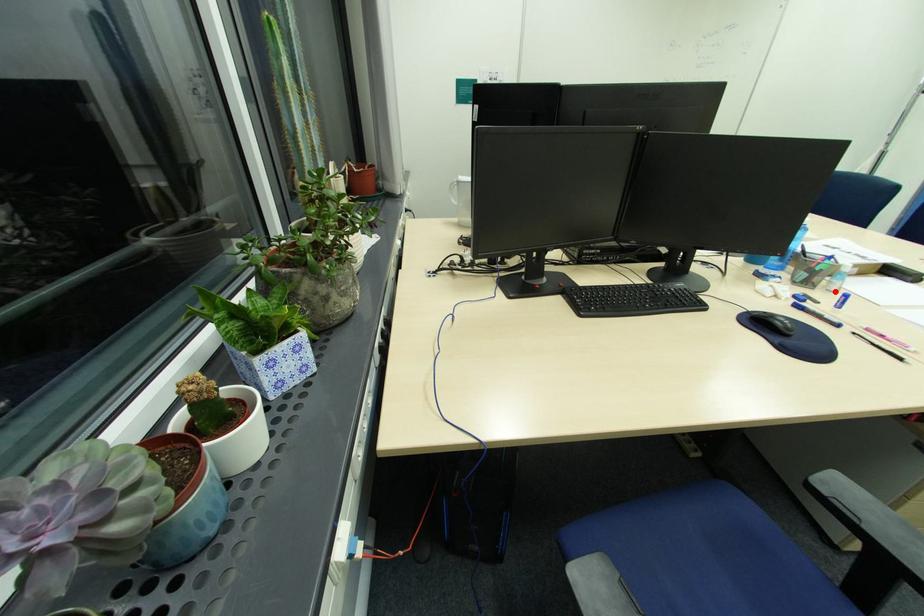
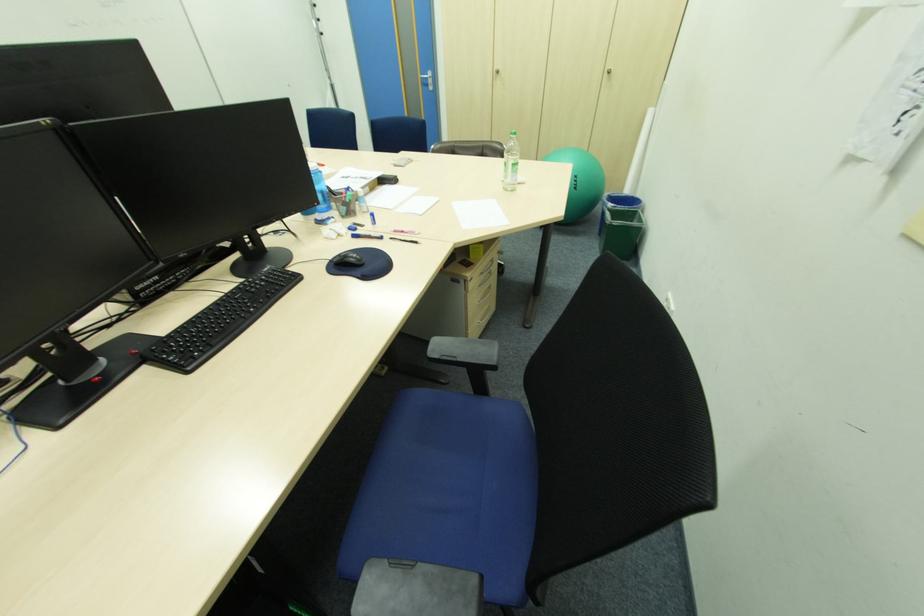
Where in the second image is the point corresponding to the highlighted location from the first image?

(370, 213)